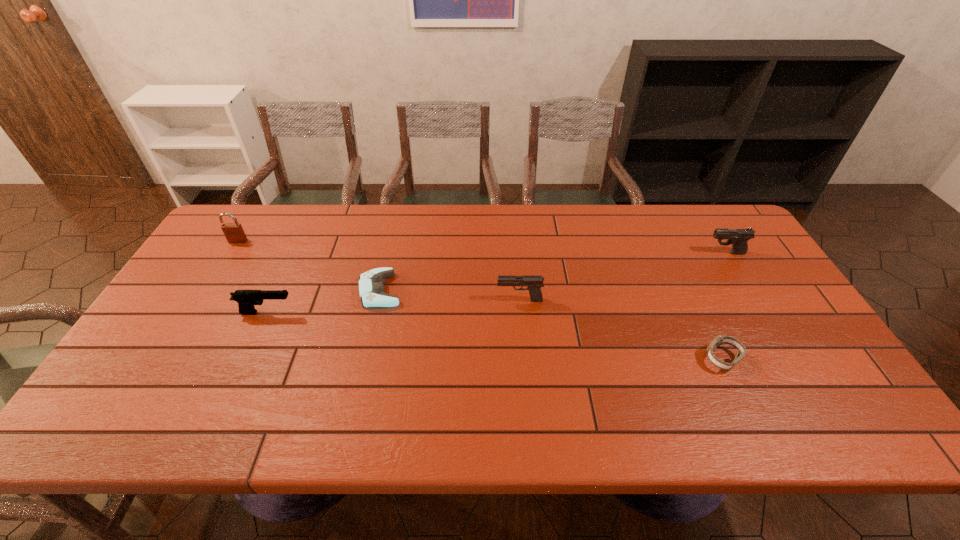
Where is `free space located 0.210m on the face of the watch`? free space located 0.210m on the face of the watch is located at coordinates (619, 359).

This screenshot has width=960, height=540. Identify the location of free region located 0.340m on the face of the watch. (566, 359).

You are a GUI agent. You are given a task and a screenshot of the screen. Output one action in this format:
    pyautogui.click(x=<x>, y=<y>)
    Task: Click on the free space located 0.350m on the face of the watch
    Image resolution: width=960 pixels, height=540 pixels.
    Given the screenshot: What is the action you would take?
    pyautogui.click(x=563, y=359)

Locate an element on the screen. The image size is (960, 540). free point located on the left of the shortest object is located at coordinates (242, 291).

Identify the location of object that is positioned at the far edge. The width and height of the screenshot is (960, 540). (234, 233).

Locate an element on the screen. object that is at the left edge is located at coordinates 234,233.

The width and height of the screenshot is (960, 540). I want to click on object at the right edge, so click(x=738, y=237).

This screenshot has height=540, width=960. I want to click on object that is at the far left corner, so click(x=234, y=233).

The height and width of the screenshot is (540, 960). Find the location of `vacant space at the far edge of the desktop`. vacant space at the far edge of the desktop is located at coordinates pos(509,235).

The image size is (960, 540). I want to click on vacant region at the near edge of the desktop, so [x=768, y=403].